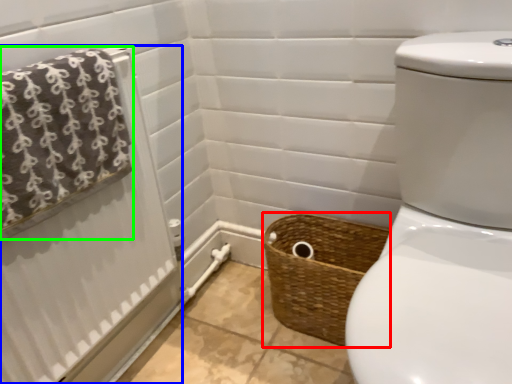
Question: Which is nearer to the basket (highlighted by a red box)? shower curtain (highlighted by a blue box) or bath towel (highlighted by a green box).

Choices:
 (A) shower curtain
 (B) bath towel

Answer: (A)